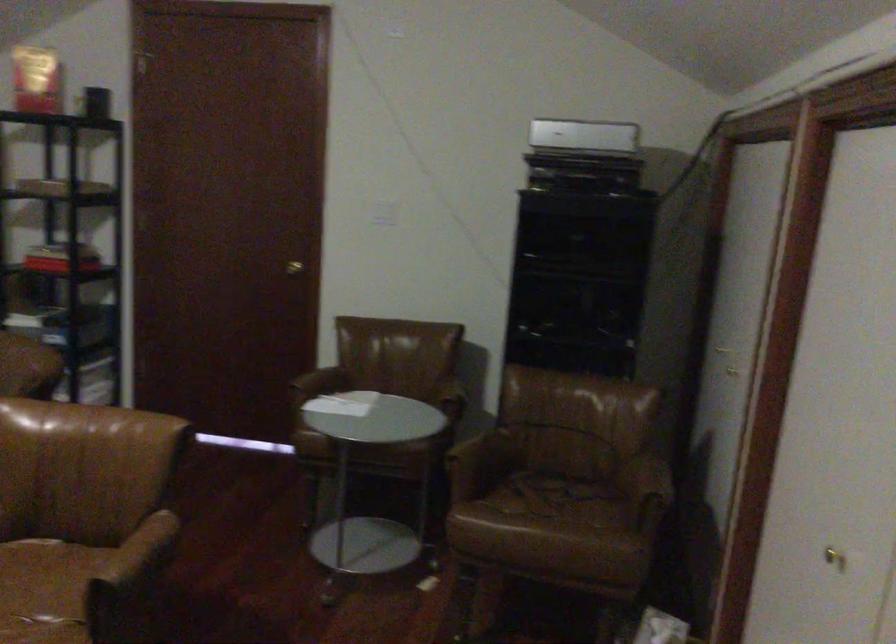
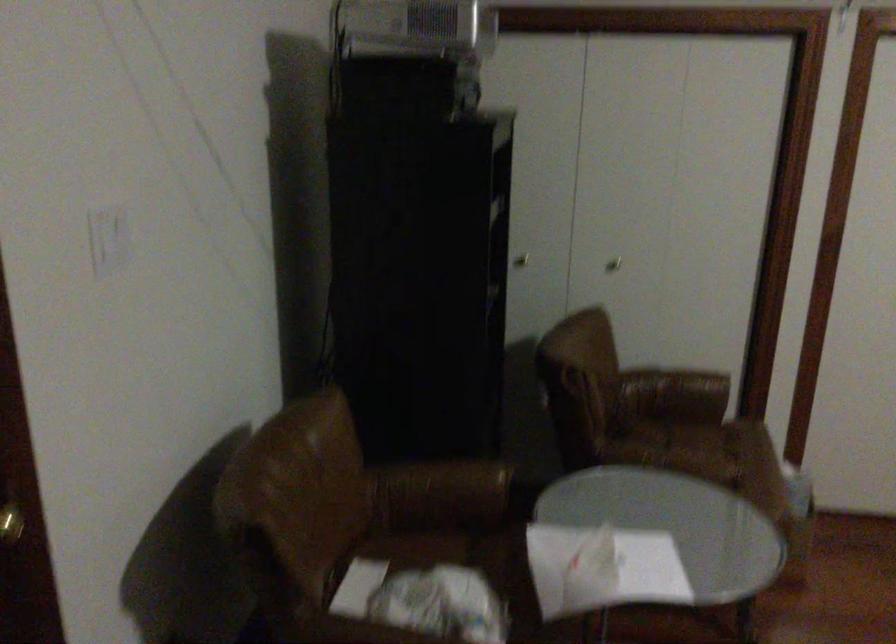
The point at [734,379] is marked in the first image. Where is the corresponding point in the second image?

(613, 263)